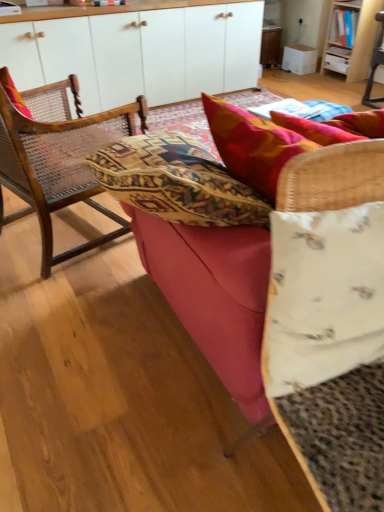
The height and width of the screenshot is (512, 384). What do you see at coordinates (137, 51) in the screenshot?
I see `white matte cabinet at upper center` at bounding box center [137, 51].

Measure the distance between textured red pillow at upper right, which ranks as the second pillow in front-to-back order, and camera.

textured red pillow at upper right, which ranks as the second pillow in front-to-back order, and camera are 32.91 inches apart from each other.

Locate an element on the screen. This screenshot has height=512, width=384. textured red pillow at upper right, which ranks as the second pillow in front-to-back order is located at coordinates (264, 142).

Describe the element at coordinates (341, 36) in the screenshot. I see `wooden bookshelf at upper right` at that location.

Identify the location of wooden cabinet at upper center. The width and height of the screenshot is (384, 512). (270, 45).

What are the coordinates of `velvet red couch at center` in the screenshot? It's located at (207, 234).

Considering the positions of objects velvet red couch at center and wooden cabinet at upper center in the image provided, who is in front, velvet red couch at center or wooden cabinet at upper center?

Positioned in front is velvet red couch at center.

Based on the photo, considering the sizes of objects velvet red couch at center and wooden cabinet at upper center in the image provided, who is thinner, velvet red couch at center or wooden cabinet at upper center?

wooden cabinet at upper center.

From a real-world perspective, is velvet red couch at center over wooden cabinet at upper center?

Indeed, from a real-world perspective, velvet red couch at center stands above wooden cabinet at upper center.

Is wooden cabinet at upper center located within velvet red couch at center?

No, velvet red couch at center does not contain wooden cabinet at upper center.

From the picture: From a real-world perspective, who is located lower, velvet red couch at center or wooden bookshelf at upper right?

In real-world perspective, velvet red couch at center is lower.

Is velvet red couch at center wider than wooden bookshelf at upper right?

Yes.

Is the position of velvet red couch at center more distant than that of wooden bookshelf at upper right?

No, it is not.

From the image's perspective, relative to textured red pillow at upper right, the second pillow when ordered from bottom to top, is white fabric pillow at center, which is the 2th pillow from top to bottom, above or below?

Clearly, from the image's perspective, white fabric pillow at center, which is the 2th pillow from top to bottom, is below textured red pillow at upper right, the second pillow when ordered from bottom to top.

From a real-world perspective, is white fabric pillow at center, which is the second pillow in back-to-front order, physically below textured red pillow at upper right, the second pillow when ordered from bottom to top?

Yes, from a real-world perspective, white fabric pillow at center, which is the second pillow in back-to-front order, is below textured red pillow at upper right, the second pillow when ordered from bottom to top.

Is textured red pillow at upper right, which ranks as the second pillow in front-to-back order, at the back of white fabric pillow at center, the first pillow when ordered from front to back?

Yes, textured red pillow at upper right, which ranks as the second pillow in front-to-back order, is at the back of white fabric pillow at center, the first pillow when ordered from front to back.

Considering the relative positions of white fabric pillow at center, which is the 2th pillow from top to bottom, and textured red pillow at upper right, the second pillow when ordered from bottom to top, in the image provided, is white fabric pillow at center, which is the 2th pillow from top to bottom, to the right of textured red pillow at upper right, the second pillow when ordered from bottom to top, from the viewer's perspective?

No, white fabric pillow at center, which is the 2th pillow from top to bottom, is not to the right of textured red pillow at upper right, the second pillow when ordered from bottom to top.

Between white fabric pillow at center, which is the 2th pillow from top to bottom, and woven wood chair at left, which one has larger size?

With larger size is woven wood chair at left.

Can you tell me how much white fabric pillow at center, the first pillow when ordered from front to back, and woven wood chair at left differ in facing direction?

The facing directions of white fabric pillow at center, the first pillow when ordered from front to back, and woven wood chair at left are 122 degrees apart.

Looking at their sizes, would you say white fabric pillow at center, which is the second pillow in back-to-front order, is wider or thinner than woven wood chair at left?

white fabric pillow at center, which is the second pillow in back-to-front order, is thinner than woven wood chair at left.

From a real-world perspective, is white fabric pillow at center, acting as the 1th pillow starting from the bottom, physically located above or below woven wood chair at left?

From a real-world perspective, white fabric pillow at center, acting as the 1th pillow starting from the bottom, is physically above woven wood chair at left.

Considering the sizes of white matte cabinet at upper center and wooden cabinet at upper center in the image, is white matte cabinet at upper center taller or shorter than wooden cabinet at upper center?

white matte cabinet at upper center is taller than wooden cabinet at upper center.

From the picture: Considering the relative positions of white matte cabinet at upper center and wooden cabinet at upper center in the image provided, is white matte cabinet at upper center to the left of wooden cabinet at upper center from the viewer's perspective?

Indeed, white matte cabinet at upper center is positioned on the left side of wooden cabinet at upper center.

Would you consider white matte cabinet at upper center to be distant from wooden cabinet at upper center?

Indeed, white matte cabinet at upper center is not near wooden cabinet at upper center.

Considering the sizes of objects velvet red couch at center and white fabric pillow at center, which is the second pillow in back-to-front order, in the image provided, who is thinner, velvet red couch at center or white fabric pillow at center, which is the second pillow in back-to-front order,?

With smaller width is white fabric pillow at center, which is the second pillow in back-to-front order.

Identify the location of the 2nd pillow counting from the left of the velvet red couch at center. (323, 296).

Between velvet red couch at center and white fabric pillow at center, the first pillow when ordered from front to back, which one is positioned in front?

Positioned in front is white fabric pillow at center, the first pillow when ordered from front to back.

From a real-world perspective, is velvet red couch at center above or below white fabric pillow at center, which is the 2th pillow from top to bottom?

Clearly, from a real-world perspective, velvet red couch at center is below white fabric pillow at center, which is the 2th pillow from top to bottom.

Is white fabric pillow at center, which is the 2th pillow from top to bottom, at the back of textured red pillow at upper right, the second pillow when ordered from bottom to top?

That's right, textured red pillow at upper right, the second pillow when ordered from bottom to top, is facing away from white fabric pillow at center, which is the 2th pillow from top to bottom.

Is textured red pillow at upper right, which ranks as the second pillow in front-to-back order, directly adjacent to white fabric pillow at center, which is the 2th pillow from top to bottom?

No, textured red pillow at upper right, which ranks as the second pillow in front-to-back order, is not beside white fabric pillow at center, which is the 2th pillow from top to bottom.

Based on the photo, considering the relative sizes of textured red pillow at upper right, which ranks as the second pillow in front-to-back order, and white fabric pillow at center, which is the second pillow in back-to-front order, in the image provided, is textured red pillow at upper right, which ranks as the second pillow in front-to-back order, smaller than white fabric pillow at center, which is the second pillow in back-to-front order,?

No, textured red pillow at upper right, which ranks as the second pillow in front-to-back order, is not smaller than white fabric pillow at center, which is the second pillow in back-to-front order.

Can we say textured red pillow at upper right, which ranks as the second pillow in front-to-back order, lies outside white fabric pillow at center, the first pillow when ordered from front to back?

Yes.

Identify the location of table behind the velvet red couch at center. The width and height of the screenshot is (384, 512). (270, 45).

What are the coordinates of `shelf above the velvet red couch at center (from a real-world perspective)` in the screenshot? It's located at (341, 36).

Which object lies nearer to the anchor point white fabric pillow at center, which is the second pillow in back-to-front order, wooden bookshelf at upper right or wooden cabinet at upper center?

wooden bookshelf at upper right lies closer to white fabric pillow at center, which is the second pillow in back-to-front order, than the other object.

Which object lies further to the anchor point woven wood chair at left, white matte cabinet at upper center or velvet red couch at center?

white matte cabinet at upper center is positioned further to the anchor woven wood chair at left.

From the image, which object appears to be nearer to velvet red couch at center, wooden cabinet at upper center or white matte cabinet at upper center?

white matte cabinet at upper center lies closer to velvet red couch at center than the other object.

When comparing their distances from velvet red couch at center, does woven wood chair at left or wooden bookshelf at upper right seem closer?

woven wood chair at left lies closer to velvet red couch at center than the other object.

From the image, which object appears to be farther from velvet red couch at center, wooden bookshelf at upper right or textured red pillow at upper right, which is the 1th pillow in back-to-front order?

wooden bookshelf at upper right lies further to velvet red couch at center than the other object.

Based on their spatial positions, is wooden cabinet at upper center or white matte cabinet at upper center closer to textured red pillow at upper right, which is the 1th pillow in back-to-front order?

white matte cabinet at upper center is closer to textured red pillow at upper right, which is the 1th pillow in back-to-front order.

Looking at the image, which one is located closer to white matte cabinet at upper center, wooden cabinet at upper center or textured red pillow at upper right, which ranks as the 1th pillow in top-to-bottom order?

Among the two, wooden cabinet at upper center is located nearer to white matte cabinet at upper center.

Which object lies nearer to the anchor point velvet red couch at center, white fabric pillow at center, acting as the 1th pillow starting from the bottom, or wooden cabinet at upper center?

Based on the image, white fabric pillow at center, acting as the 1th pillow starting from the bottom, appears to be nearer to velvet red couch at center.

This screenshot has height=512, width=384. What are the coordinates of `cabinetry between textured red pillow at upper right, which ranks as the second pillow in front-to-back order, and wooden cabinet at upper center in the front-back direction` in the screenshot? It's located at pyautogui.click(x=137, y=51).

What are the coordinates of `chair between velvet red couch at center and white matte cabinet at upper center from front to back` in the screenshot? It's located at (56, 156).

The width and height of the screenshot is (384, 512). Identify the location of studio couch between white fabric pillow at center, acting as the 1th pillow starting from the bottom, and wooden bookshelf at upper right, along the z-axis. (207, 234).

You are a GUI agent. You are given a task and a screenshot of the screen. Output one action in this format:
    pyautogui.click(x=<x>, y=<y>)
    Task: Click on the cabinetry between textured red pillow at upper right, which is the 1th pillow in back-to-front order, and wooden bookshelf at upper right from front to back
    
    Given the screenshot: What is the action you would take?
    pyautogui.click(x=137, y=51)